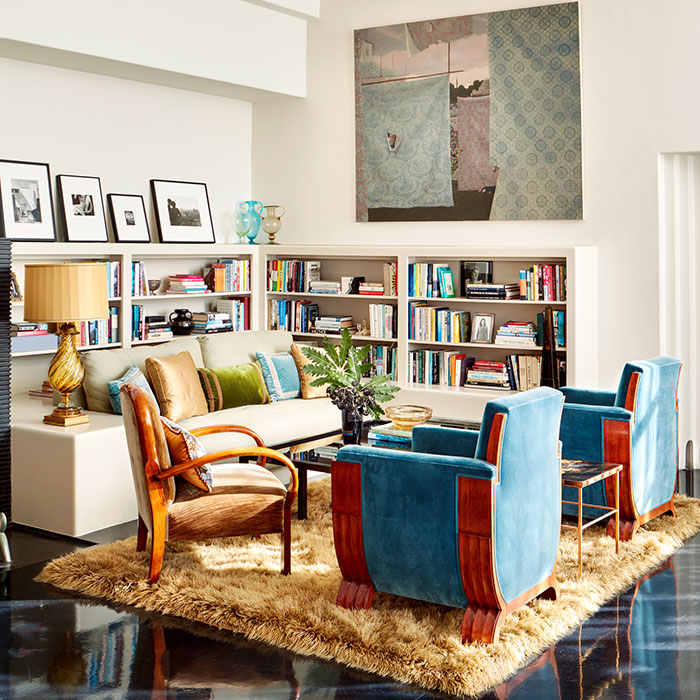
Where is `lamp`? The image size is (700, 700). lamp is located at coordinates (57, 363), (70, 378), (70, 285).